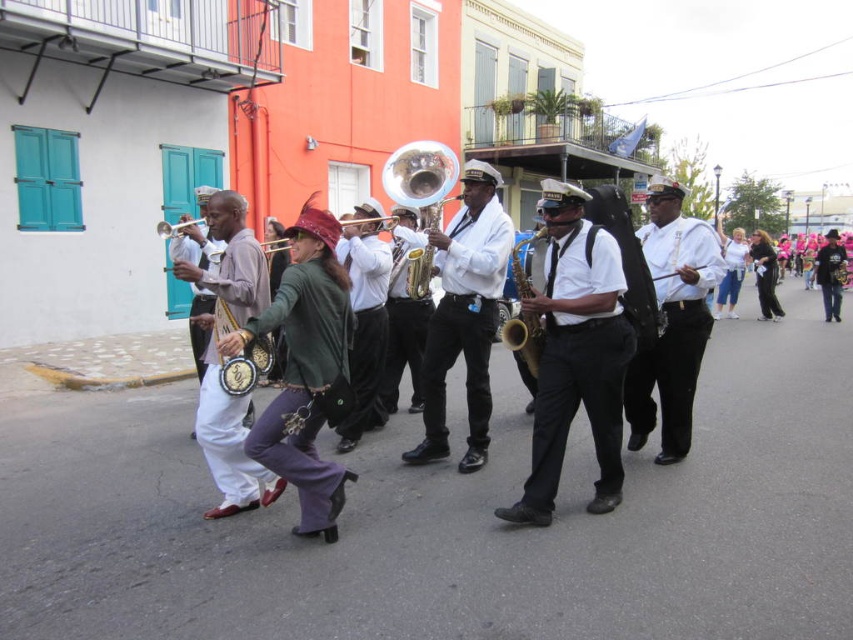
Question: Is white matte uniform at center smaller than white cotton pants at center?

Choices:
 (A) yes
 (B) no

Answer: (B)

Question: Is white cotton pants at center closer to the viewer compared to brushed brass trumpet at center?

Choices:
 (A) yes
 (B) no

Answer: (A)

Question: Can you confirm if wooden saxophone at center is thinner than white matte uniform at center?

Choices:
 (A) yes
 (B) no

Answer: (B)

Question: Which of the following is the farthest from the observer?

Choices:
 (A) (376, 220)
 (B) (364, 253)
 (C) (527, 291)
 (D) (759, 241)

Answer: (D)

Question: Considering the real-world distances, which object is farthest from the white cotton pants at center?

Choices:
 (A) shiny gold trumpet at center
 (B) white matte uniform at center
 (C) shiny gold saxophone at center

Answer: (C)

Question: Which of the following is the farthest from the observer?

Choices:
 (A) (433, 268)
 (B) (512, 260)
 (C) (383, 269)

Answer: (C)